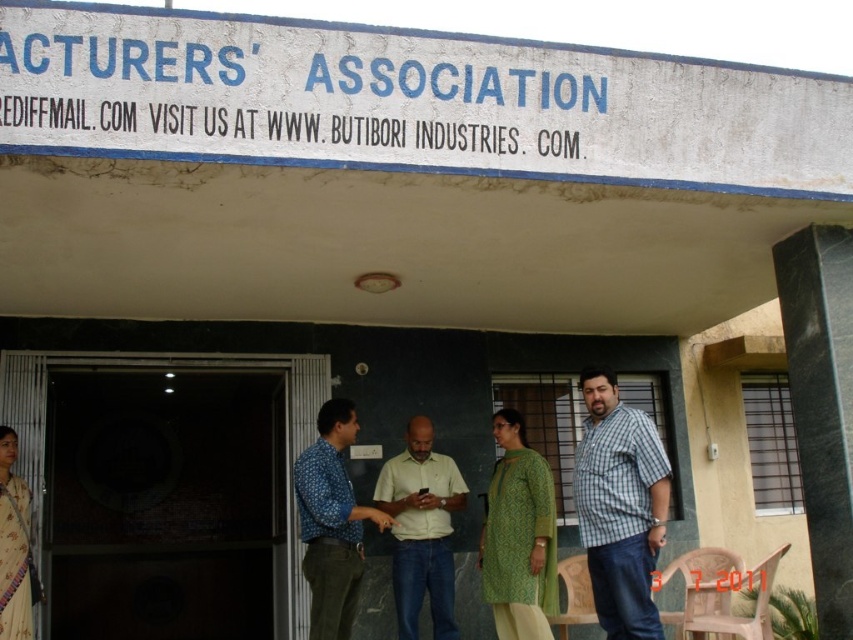
At what (x,y) coordinates should I click in order to perform the action: click on white concrete sign at upper center. Please return your answer as a coordinate pair (x, y). Looking at the image, I should click on (410, 100).

Does white concrete sign at upper center have a larger size compared to beige silk saree at left?

Yes.

What do you see at coordinates (410, 100) in the screenshot? The height and width of the screenshot is (640, 853). I see `white concrete sign at upper center` at bounding box center [410, 100].

Find the location of a particular element. The width and height of the screenshot is (853, 640). white concrete sign at upper center is located at coordinates (410, 100).

This screenshot has height=640, width=853. What are the coordinates of `white concrete sign at upper center` in the screenshot? It's located at coord(410,100).

Does white concrete sign at upper center have a larger size compared to blue patterned shirt at center?

Yes, white concrete sign at upper center is bigger than blue patterned shirt at center.

Locate an element on the screen. The height and width of the screenshot is (640, 853). white concrete sign at upper center is located at coordinates (410, 100).

Can you confirm if green textured kurta at center is positioned to the right of blue patterned shirt at center?

Correct, you'll find green textured kurta at center to the right of blue patterned shirt at center.

Who is lower down, green textured kurta at center or blue patterned shirt at center?

green textured kurta at center is below.

This screenshot has width=853, height=640. Find the location of `green textured kurta at center`. green textured kurta at center is located at coordinates (518, 536).